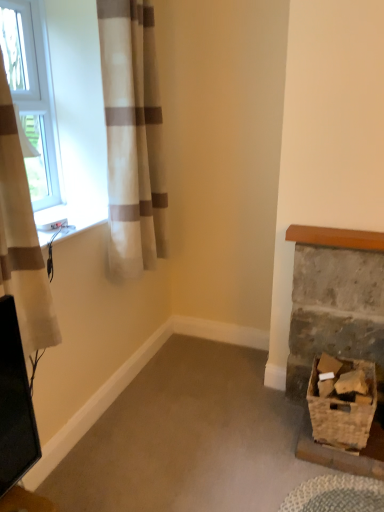
The height and width of the screenshot is (512, 384). In order to click on vacant space in front of woven brown basket at lower right in this screenshot , I will do `click(339, 481)`.